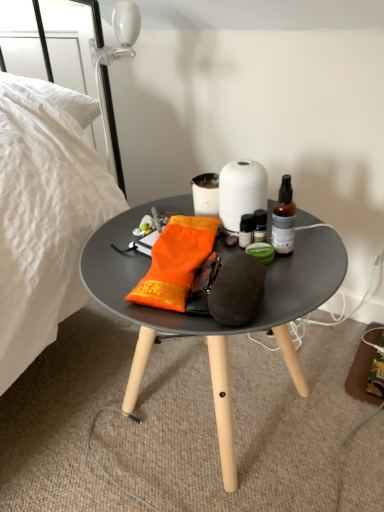
Locate an element on the screen. vacant region to the left of orange fabric pouch at center is located at coordinates (117, 272).